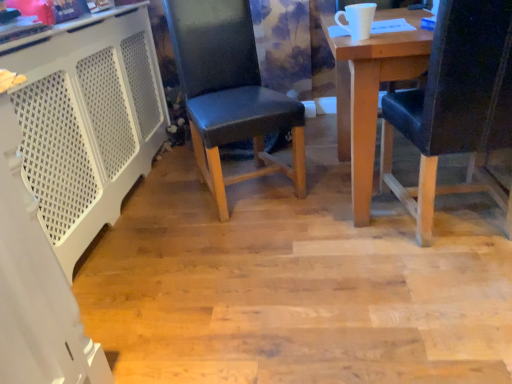
Question: From a real-world perspective, is black leather chair at center, placed as the 1th chair when sorted from left to right, located higher than white perforated plastic at left?

Choices:
 (A) yes
 (B) no

Answer: (A)

Question: Does black leather chair at center, marked as the second chair in a right-to-left arrangement, appear on the right side of white perforated plastic at left?

Choices:
 (A) yes
 (B) no

Answer: (A)

Question: Could you tell me if black leather chair at center, placed as the 1th chair when sorted from left to right, is turned towards white perforated plastic at left?

Choices:
 (A) no
 (B) yes

Answer: (A)

Question: Is black leather chair at center, marked as the second chair in a right-to-left arrangement, shorter than white perforated plastic at left?

Choices:
 (A) yes
 (B) no

Answer: (B)

Question: Is the depth of black leather chair at center, marked as the second chair in a right-to-left arrangement, less than that of white perforated plastic at left?

Choices:
 (A) yes
 (B) no

Answer: (B)

Question: Considering the positions of white perforated plastic at left and black leather chair at center, placed as the 1th chair when sorted from left to right, in the image, is white perforated plastic at left wider or thinner than black leather chair at center, placed as the 1th chair when sorted from left to right,?

Choices:
 (A) wide
 (B) thin

Answer: (B)

Question: Looking at the image, does white perforated plastic at left seem bigger or smaller compared to black leather chair at center, marked as the second chair in a right-to-left arrangement?

Choices:
 (A) big
 (B) small

Answer: (A)

Question: Would you say white perforated plastic at left is to the left or to the right of black leather chair at center, placed as the 1th chair when sorted from left to right, in the picture?

Choices:
 (A) right
 (B) left

Answer: (B)

Question: Considering the positions of white perforated plastic at left and black leather chair at center, placed as the 1th chair when sorted from left to right, in the image, is white perforated plastic at left taller or shorter than black leather chair at center, placed as the 1th chair when sorted from left to right,?

Choices:
 (A) short
 (B) tall

Answer: (A)

Question: In the image, is black leather chair at right, which is counted as the 2th chair, starting from the left, positioned in front of or behind black leather chair at center, placed as the 1th chair when sorted from left to right?

Choices:
 (A) front
 (B) behind

Answer: (A)

Question: Considering the positions of black leather chair at right, the 1th chair in the right-to-left sequence, and black leather chair at center, placed as the 1th chair when sorted from left to right, in the image, is black leather chair at right, the 1th chair in the right-to-left sequence, wider or thinner than black leather chair at center, placed as the 1th chair when sorted from left to right,?

Choices:
 (A) wide
 (B) thin

Answer: (A)

Question: Is point (439, 127) positioned closer to the camera than point (208, 127)?

Choices:
 (A) closer
 (B) farther

Answer: (A)

Question: From a real-world perspective, is black leather chair at right, which is counted as the 2th chair, starting from the left, positioned above or below black leather chair at center, marked as the second chair in a right-to-left arrangement?

Choices:
 (A) above
 (B) below

Answer: (B)

Question: In the image, is white perforated plastic at left on the left side or the right side of black leather chair at right, the 1th chair in the right-to-left sequence?

Choices:
 (A) right
 (B) left

Answer: (B)

Question: From a real-world perspective, relative to black leather chair at right, the 1th chair in the right-to-left sequence, is white perforated plastic at left vertically above or below?

Choices:
 (A) below
 (B) above

Answer: (A)